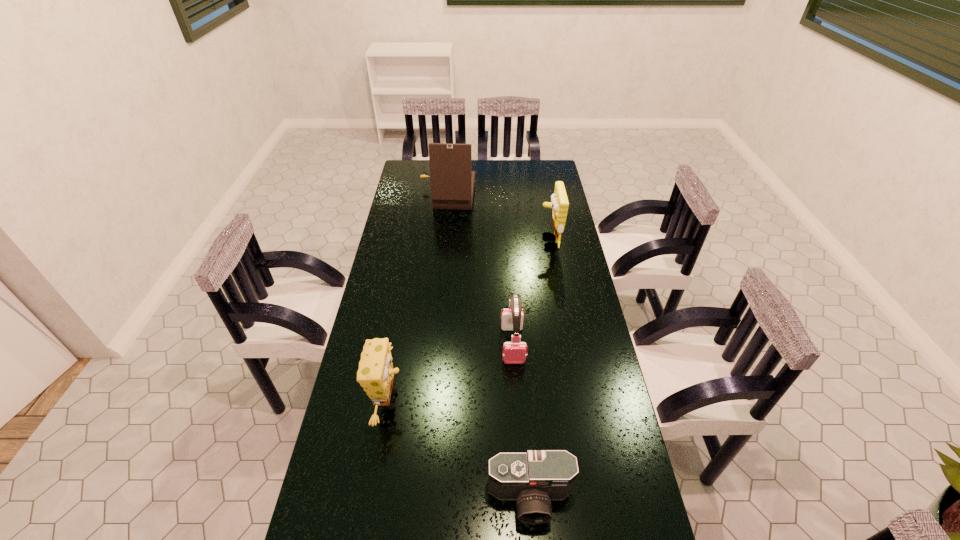
Identify the location of the farthest object. (452, 180).

The height and width of the screenshot is (540, 960). I want to click on the tallest object, so click(x=452, y=180).

This screenshot has width=960, height=540. What are the coordinates of `the taller sponge` in the screenshot? It's located at (559, 204).

I want to click on the second tallest object, so click(559, 204).

Where is `the left sponge`? This screenshot has height=540, width=960. the left sponge is located at coordinates (375, 374).

Locate an element on the screen. the nearer sponge is located at coordinates 375,374.

At what (x,y) coordinates should I click in order to perform the action: click on earphone. Please return your answer as a coordinate pair (x, y). Looking at the image, I should click on (514, 352).

Find the location of a particular element. the shortest object is located at coordinates (533, 479).

The image size is (960, 540). In order to click on camera in this screenshot , I will do `click(533, 479)`.

At what (x,y) coordinates should I click in order to perform the action: click on free space located on the front of the phonograph record. Please return your answer as a coordinate pair (x, y). The image size is (960, 540). Looking at the image, I should click on (443, 248).